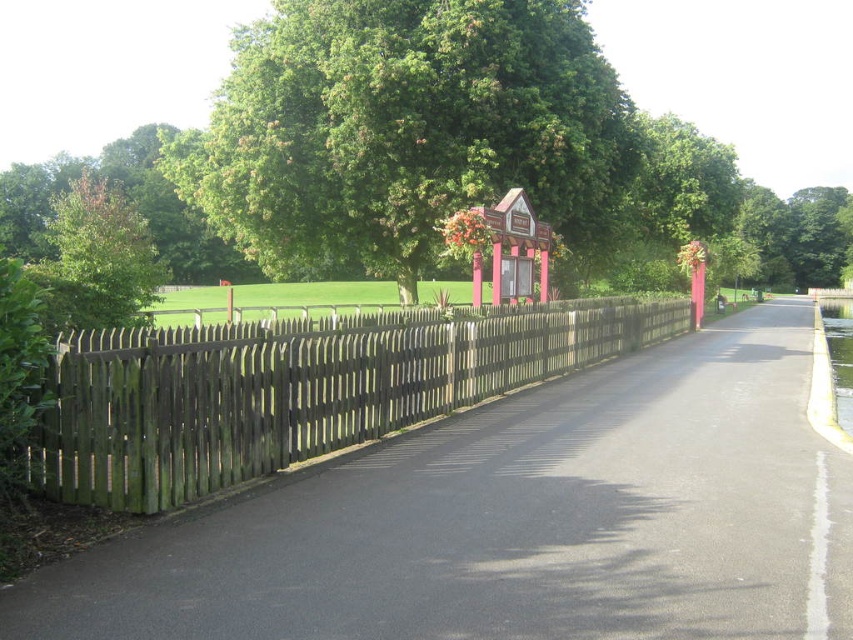
Where is `weathered wood fence at left`? This screenshot has height=640, width=853. weathered wood fence at left is located at coordinates (294, 388).

Is point (364, 403) positioned behind point (129, 282)?

No, it is in front of (129, 282).

Between point (595, 339) and point (123, 209), which one is positioned behind?

The point (123, 209) is behind.

Where is `weathered wood fence at left`? The image size is (853, 640). weathered wood fence at left is located at coordinates (294, 388).

Between green leafy tree at center and weathered wood fence at left, which one has less height?

Standing shorter between the two is weathered wood fence at left.

Does green leafy tree at center have a smaller size compared to weathered wood fence at left?

Actually, green leafy tree at center might be larger than weathered wood fence at left.

Locate an element on the screen. Image resolution: width=853 pixels, height=640 pixels. green leafy tree at center is located at coordinates (403, 129).

Locate an element on the screen. green leafy tree at center is located at coordinates (403, 129).

Between green leafy tree at center and green leafy tree at left, which one appears on the right side from the viewer's perspective?

green leafy tree at center is more to the right.

Who is taller, green leafy tree at center or green leafy tree at left?

green leafy tree at left

The width and height of the screenshot is (853, 640). In order to click on green leafy tree at center in this screenshot , I will do `click(403, 129)`.

You are a GUI agent. You are given a task and a screenshot of the screen. Output one action in this format:
    pyautogui.click(x=<x>, y=<y>)
    Task: Click on the green leafy tree at center
    
    Given the screenshot: What is the action you would take?
    pyautogui.click(x=403, y=129)